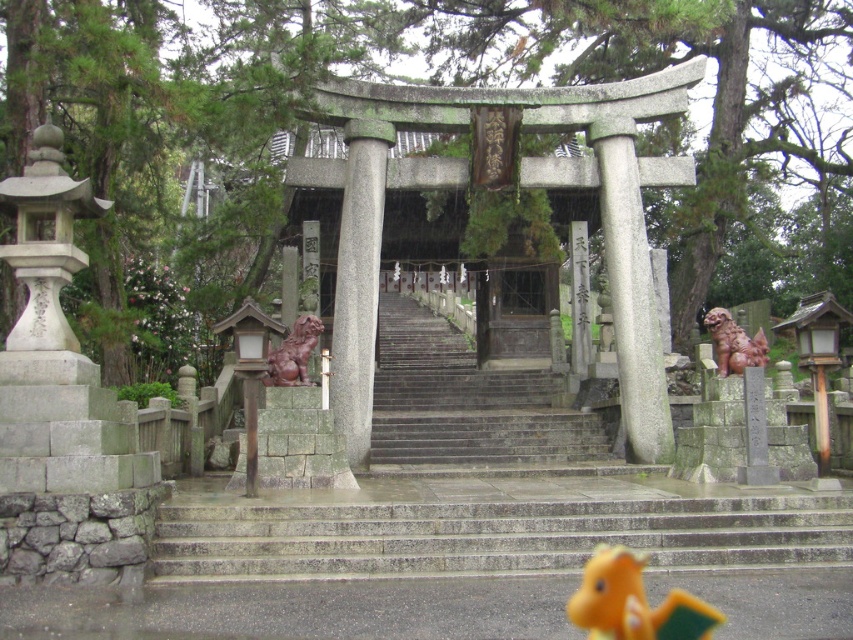
You are standing at the base of the stone steps leading to the torii gate. You want to take a photo of the torii gate from a position where you are exactly 24.44 meters away from the point marked as point (747, 337). Where should you position yourself to achieve this distance?

You should position yourself at the camera location because the point (747, 337) and the camera are 24.44 meters apart, so standing at the camera position ensures you are exactly 24.44 meters away from the specified point.

You are a visitor approaching the torii gate and notice the gray polished stone column at center and the orange plush toy at lower center. Which object would you have to look up to see?

The gray polished stone column at center is much taller than the orange plush toy at lower center, so you would have to look up to see the gray polished stone column at center.